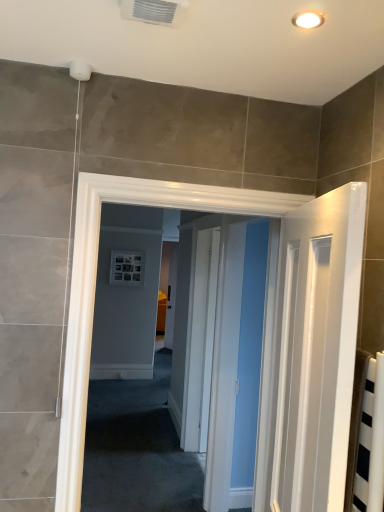
Question: From the image's perspective, is warm matte light fixture at upper center positioned above or below white plastic air conditioning unit at upper center?

Choices:
 (A) below
 (B) above

Answer: (A)

Question: In terms of width, does warm matte light fixture at upper center look wider or thinner when compared to white plastic air conditioning unit at upper center?

Choices:
 (A) wide
 (B) thin

Answer: (B)

Question: From a real-world perspective, is warm matte light fixture at upper center physically located above or below white plastic air conditioning unit at upper center?

Choices:
 (A) below
 (B) above

Answer: (B)

Question: Does point (185, 0) appear closer or farther from the camera than point (309, 27)?

Choices:
 (A) closer
 (B) farther

Answer: (A)

Question: From the image's perspective, relative to warm matte light fixture at upper center, is white plastic air conditioning unit at upper center above or below?

Choices:
 (A) below
 (B) above

Answer: (B)

Question: Considering the positions of white plastic air conditioning unit at upper center and warm matte light fixture at upper center in the image, is white plastic air conditioning unit at upper center bigger or smaller than warm matte light fixture at upper center?

Choices:
 (A) big
 (B) small

Answer: (A)

Question: From their relative heights in the image, would you say white plastic air conditioning unit at upper center is taller or shorter than warm matte light fixture at upper center?

Choices:
 (A) tall
 (B) short

Answer: (A)